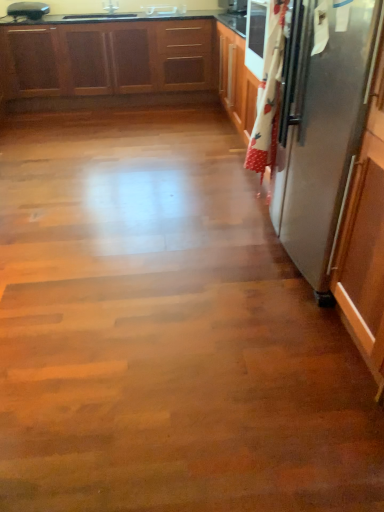
Question: From a real-world perspective, is metallic silver toaster at upper left positioned over wooden cabinets at upper left based on gravity?

Choices:
 (A) yes
 (B) no

Answer: (A)

Question: Can you confirm if metallic silver toaster at upper left is shorter than wooden cabinets at upper left?

Choices:
 (A) no
 (B) yes

Answer: (B)

Question: From the image's perspective, would you say metallic silver toaster at upper left is shown under wooden cabinets at upper left?

Choices:
 (A) yes
 (B) no

Answer: (B)

Question: Is metallic silver toaster at upper left positioned behind wooden cabinets at upper left?

Choices:
 (A) yes
 (B) no

Answer: (A)

Question: From a real-world perspective, is metallic silver toaster at upper left physically below wooden cabinets at upper left?

Choices:
 (A) no
 (B) yes

Answer: (A)

Question: In terms of size, does metallic silver toaster at upper left appear bigger or smaller than satin silver refrigerator at right?

Choices:
 (A) small
 (B) big

Answer: (A)

Question: From the image's perspective, is metallic silver toaster at upper left positioned above or below satin silver refrigerator at right?

Choices:
 (A) below
 (B) above

Answer: (B)

Question: Relative to satin silver refrigerator at right, is metallic silver toaster at upper left in front or behind?

Choices:
 (A) front
 (B) behind

Answer: (B)

Question: Which is correct: metallic silver toaster at upper left is inside satin silver refrigerator at right, or outside of it?

Choices:
 (A) outside
 (B) inside

Answer: (A)

Question: Relative to wooden cabinets at upper left, is white glossy sink at upper center in front or behind?

Choices:
 (A) front
 (B) behind

Answer: (B)

Question: Looking at their shapes, would you say white glossy sink at upper center is wider or thinner than wooden cabinets at upper left?

Choices:
 (A) thin
 (B) wide

Answer: (A)

Question: From the image's perspective, is white glossy sink at upper center positioned above or below wooden cabinets at upper left?

Choices:
 (A) above
 (B) below

Answer: (A)

Question: From a real-world perspective, is white glossy sink at upper center physically located above or below wooden cabinets at upper left?

Choices:
 (A) above
 (B) below

Answer: (A)

Question: Looking at their shapes, would you say wooden cabinets at upper left is wider or thinner than white glossy sink at upper center?

Choices:
 (A) wide
 (B) thin

Answer: (A)

Question: In terms of height, does wooden cabinets at upper left look taller or shorter compared to white glossy sink at upper center?

Choices:
 (A) short
 (B) tall

Answer: (B)